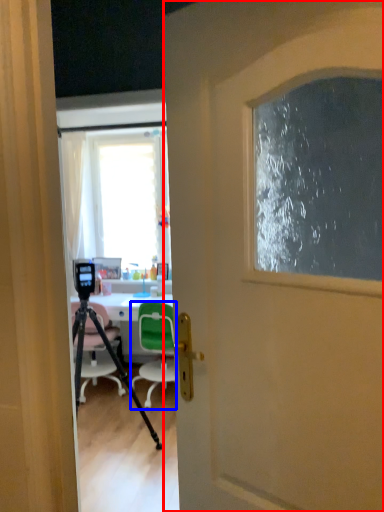
Question: Among these objects, which one is farthest to the camera, door (highlighted by a red box) or chair (highlighted by a blue box)?

Choices:
 (A) door
 (B) chair

Answer: (B)